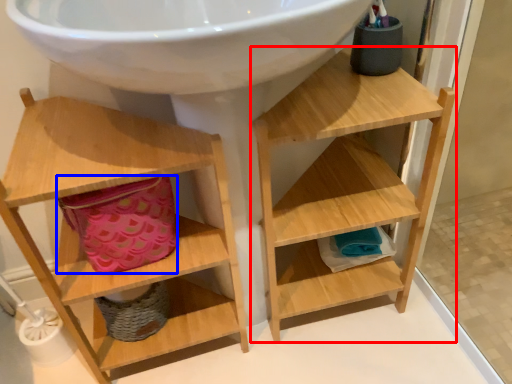
Question: Which object is further to the camera taking this photo, shelf (highlighted by a red box) or basket (highlighted by a blue box)?

Choices:
 (A) shelf
 (B) basket

Answer: (B)